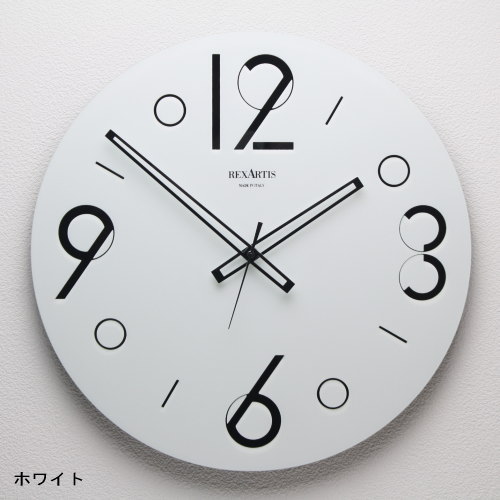
At what (x,y) coordinates should I click in order to perform the action: click on wall. Please return your answer as a coordinate pair (x, y). This screenshot has width=500, height=500. Looking at the image, I should click on (38, 401).